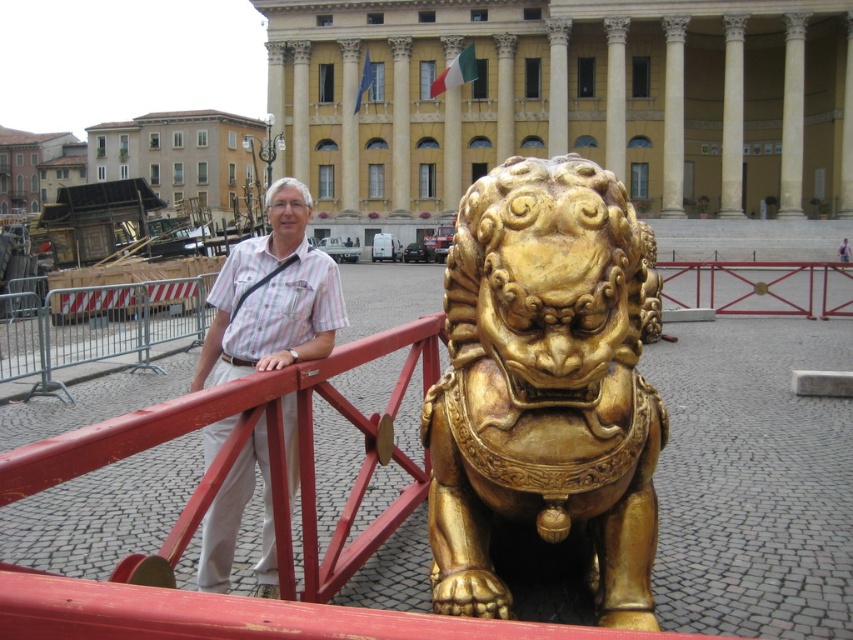
Question: Which is farther from the metallic silver fence at left?

Choices:
 (A) white striped shirt at center
 (B) gold polished lion at center

Answer: (B)

Question: Among these objects, which one is nearest to the camera?

Choices:
 (A) metallic silver fence at left
 (B) gold polished lion at center

Answer: (B)

Question: Is white striped shirt at center above metallic silver fence at left?

Choices:
 (A) yes
 (B) no

Answer: (B)

Question: Does gold polished lion at center appear under white striped shirt at center?

Choices:
 (A) no
 (B) yes

Answer: (A)

Question: Which is nearer to the white striped shirt at center?

Choices:
 (A) metallic silver fence at left
 (B) gold polished lion at center

Answer: (B)

Question: Does white striped shirt at center have a lesser width compared to metallic silver fence at left?

Choices:
 (A) yes
 (B) no

Answer: (A)